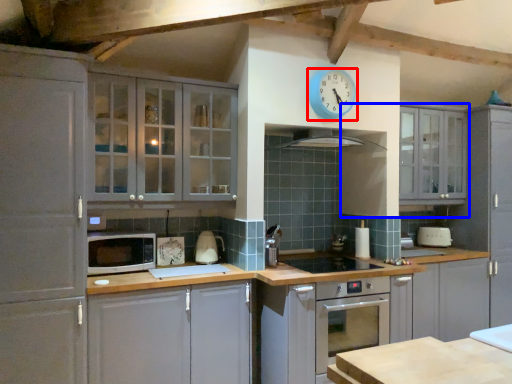
Question: Among these objects, which one is nearest to the camera, clock (highlighted by a red box) or cabinetry (highlighted by a blue box)?

Choices:
 (A) clock
 (B) cabinetry

Answer: (A)